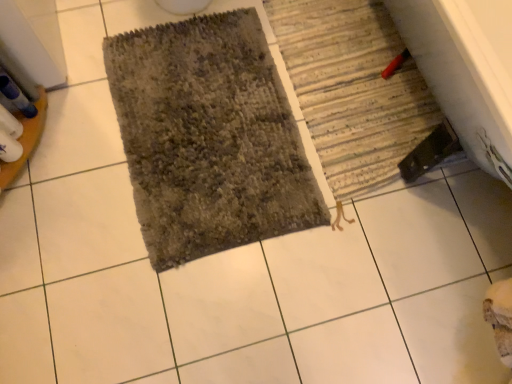
The image size is (512, 384). In order to click on vacant area that lies between textured gray bath mat at center, the 1th bath mat viewed from the left, and striped fabric bath mat at lower right, the second bath mat viewed from the left in this screenshot , I will do `click(319, 134)`.